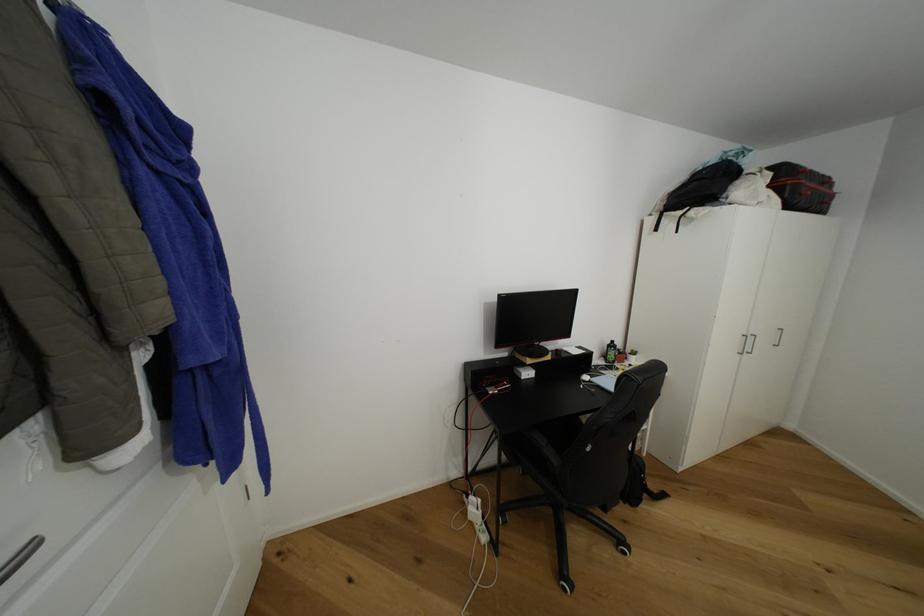
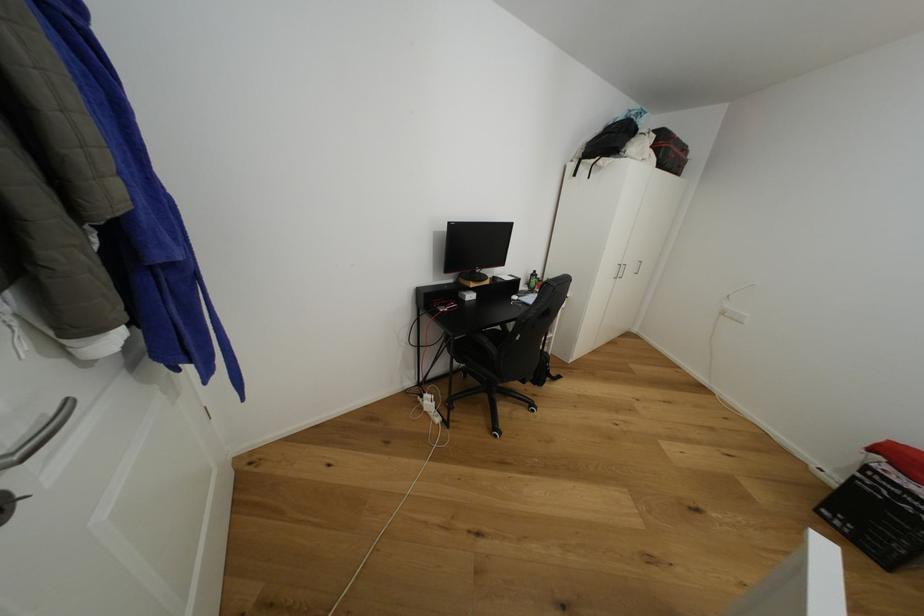
Find the pixel in the second image that matches (x=775, y=169) in the first image.

(660, 132)